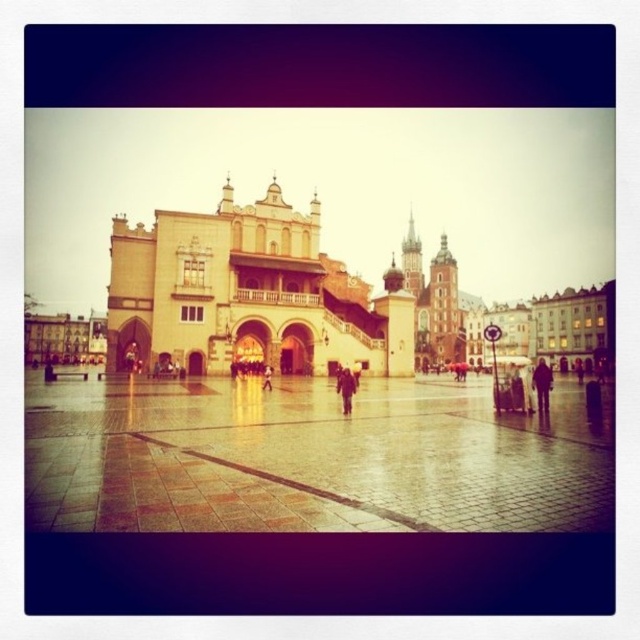
Question: Where is light brown leather jacket at lower right located in relation to light brown leather jacket at center in the image?

Choices:
 (A) above
 (B) below

Answer: (B)

Question: Does light brown leather jacket at lower right have a greater width compared to light brown leather jacket at center?

Choices:
 (A) yes
 (B) no

Answer: (A)

Question: Which point is farther from the camera taking this photo?

Choices:
 (A) (342, 369)
 (B) (540, 401)

Answer: (A)

Question: Is light brown leather jacket at lower right thinner than light brown leather jacket at center?

Choices:
 (A) no
 (B) yes

Answer: (A)

Question: Which object is closer to the camera taking this photo?

Choices:
 (A) light brown leather jacket at center
 (B) light brown leather jacket at lower right

Answer: (A)